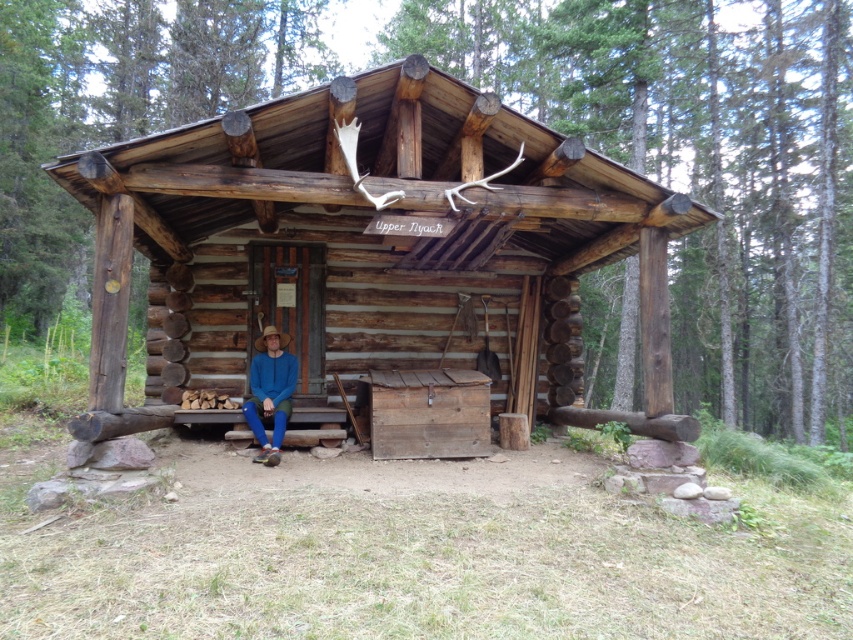
You are standing in front of the rustic wooden cabin at center and the blue cotton shirt at center. Which object is positioned to the right of the other?

The rustic wooden cabin at center is positioned to the right of the blue cotton shirt at center.

You are planning to take a photo of the rustic wooden cabin at center and the blue cotton shirt at center. Which object should you focus on first if you want to capture both in the same frame without moving the camera?

The rustic wooden cabin at center is wider than the blue cotton shirt at center, so you should focus on the rustic wooden cabin at center first to ensure it fits in the frame.

In the scene shown: You are standing in front of the rustic wooden cabin at center and see the blue cotton shirt at center. Which object is higher in position?

The rustic wooden cabin at center is located above the blue cotton shirt at center, so the rustic wooden cabin at center is higher in position.